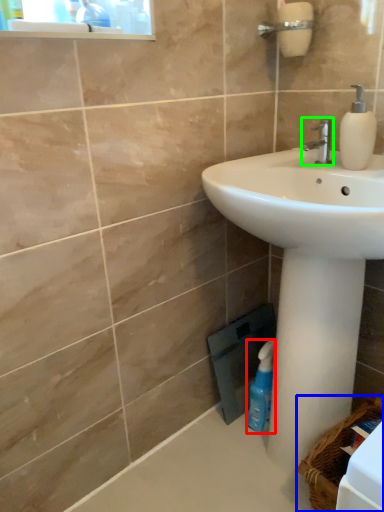
Question: Estimate the real-world distances between objects in this image. Which object is closer to cleaning product (highlighted by a red box), basket (highlighted by a blue box) or tap (highlighted by a green box)?

Choices:
 (A) basket
 (B) tap

Answer: (A)